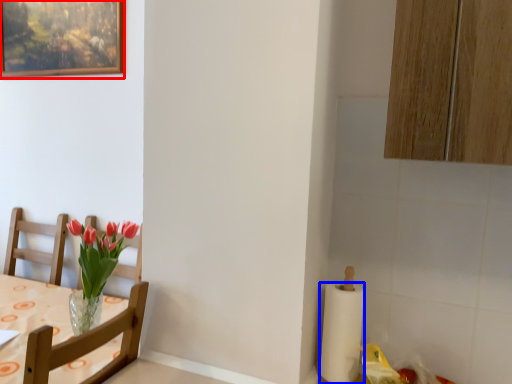
Question: Which object appears closest to the camera in this image, picture frame (highlighted by a red box) or paper towel (highlighted by a blue box)?

Choices:
 (A) picture frame
 (B) paper towel

Answer: (B)